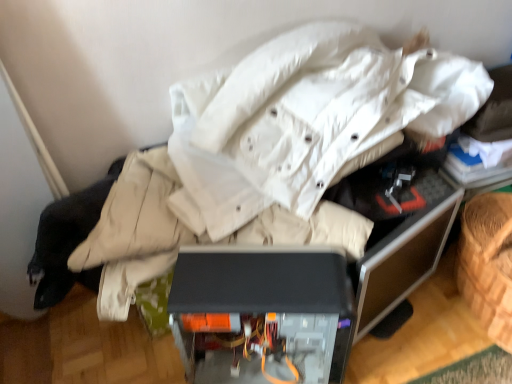
Question: Is transparent plastic case at center a part of matte black computer case at center?

Choices:
 (A) yes
 (B) no

Answer: (B)

Question: Is matte black computer case at center smaller than transparent plastic case at center?

Choices:
 (A) no
 (B) yes

Answer: (A)

Question: Would you say matte black computer case at center is a long distance from transparent plastic case at center?

Choices:
 (A) yes
 (B) no

Answer: (B)

Question: Considering the relative sizes of matte black computer case at center and transparent plastic case at center in the image provided, is matte black computer case at center taller than transparent plastic case at center?

Choices:
 (A) yes
 (B) no

Answer: (B)

Question: Is matte black computer case at center looking in the opposite direction of transparent plastic case at center?

Choices:
 (A) yes
 (B) no

Answer: (A)

Question: From a real-world perspective, is matte black computer case at center on transparent plastic case at center?

Choices:
 (A) no
 (B) yes

Answer: (A)

Question: Can you confirm if transparent plastic case at center is smaller than matte black computer case at center?

Choices:
 (A) no
 (B) yes

Answer: (B)

Question: Is transparent plastic case at center shorter than matte black computer case at center?

Choices:
 (A) no
 (B) yes

Answer: (A)

Question: Does transparent plastic case at center come behind matte black computer case at center?

Choices:
 (A) yes
 (B) no

Answer: (A)

Question: Is transparent plastic case at center to the left of matte black computer case at center from the viewer's perspective?

Choices:
 (A) no
 (B) yes

Answer: (A)

Question: From a real-world perspective, is transparent plastic case at center positioned over matte black computer case at center based on gravity?

Choices:
 (A) yes
 (B) no

Answer: (A)

Question: Is transparent plastic case at center positioned with its back to matte black computer case at center?

Choices:
 (A) no
 (B) yes

Answer: (A)

Question: From the image's perspective, is transparent plastic case at center positioned above or below matte black computer case at center?

Choices:
 (A) below
 (B) above

Answer: (B)